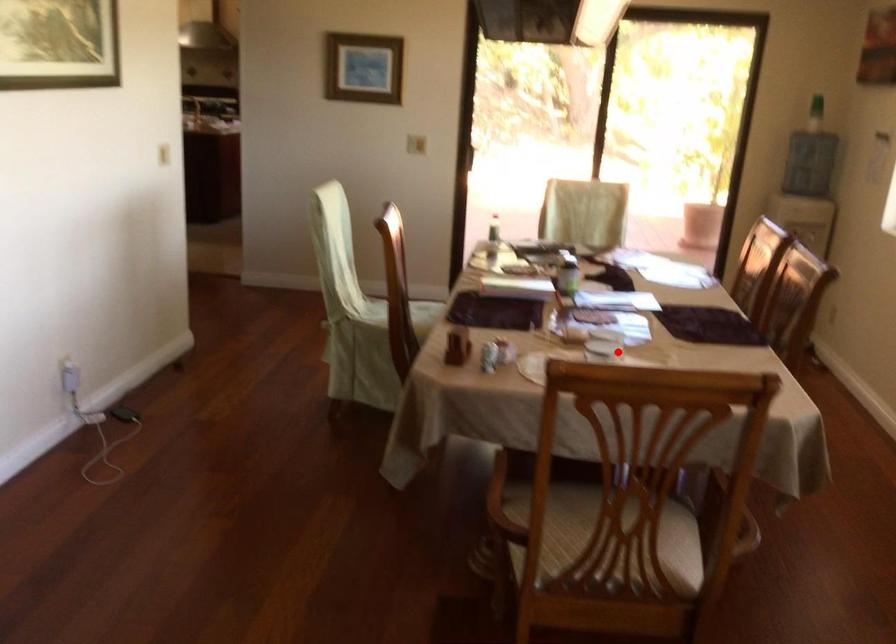
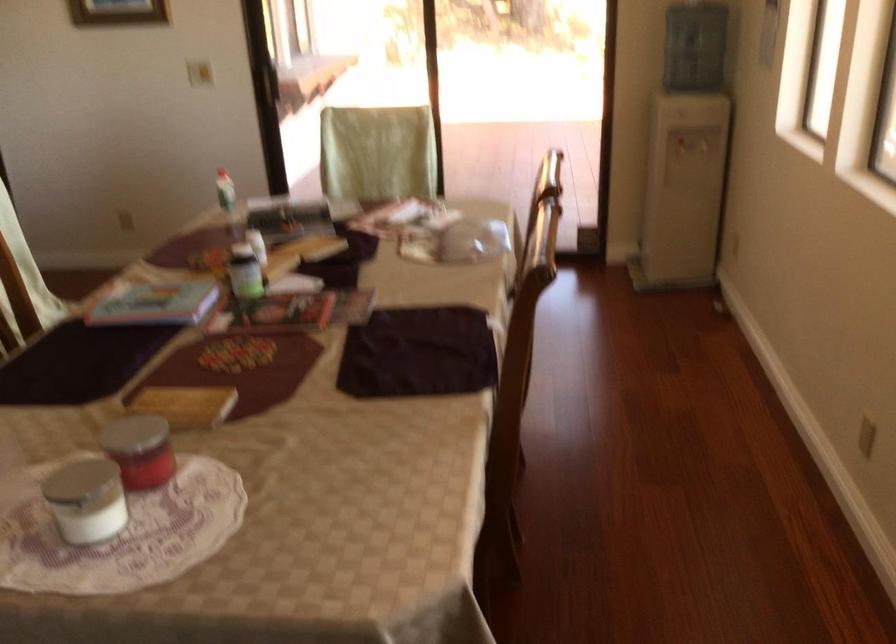
Question: I am providing you with two images of the same scene from different viewpoints. Image1 has a red point marked. In image2, the corresponding 3D location appears at what relative position? Reply with the corresponding letter.

Choices:
 (A) Closer
 (B) Farther

Answer: (A)